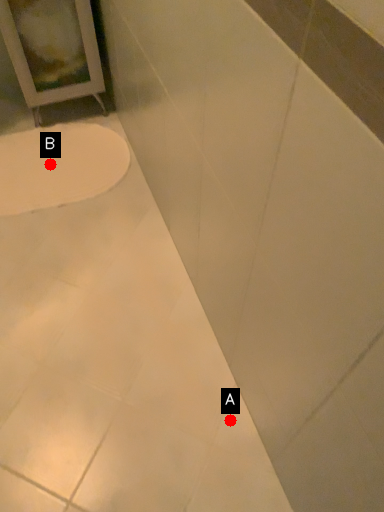
Question: Two points are circled on the image, labeled by A and B beside each circle. Which point is farther to the camera?

Choices:
 (A) A is further
 (B) B is further

Answer: (B)